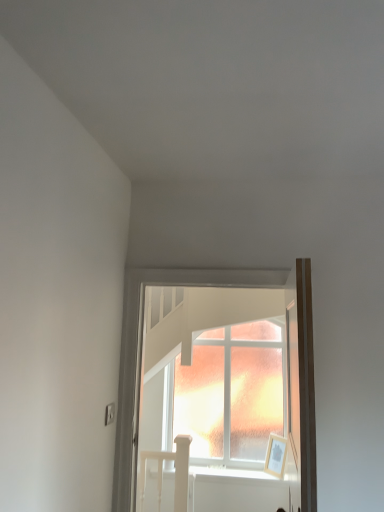
Locate an element on the screen. This screenshot has height=512, width=384. white wooden bed at lower left is located at coordinates (175, 472).

Describe the element at coordinates (175, 472) in the screenshot. The height and width of the screenshot is (512, 384). I see `white wooden bed at lower left` at that location.

Measure the distance between point (158, 472) and camera.

Point (158, 472) and camera are 14.06 feet apart from each other.

What do you see at coordinates (141, 356) in the screenshot? I see `frosted glass window at center` at bounding box center [141, 356].

Find the location of a particular element. The width and height of the screenshot is (384, 512). frosted glass window at center is located at coordinates (141, 356).

In order to face frosted glass window at center, should I rotate leftwards or rightwards?

It's best to rotate right around 2.630 degrees.

Locate an element on the screen. The height and width of the screenshot is (512, 384). white wooden bed at lower left is located at coordinates (175, 472).

Looking at this image, is white wooden bed at lower left to the right of frosted glass window at center from the viewer's perspective?

No, white wooden bed at lower left is not to the right of frosted glass window at center.

Which object is closer to the camera, white wooden bed at lower left or frosted glass window at center?

frosted glass window at center.

Which is behind, point (178, 486) or point (306, 502)?

Point (178, 486)

From the image's perspective, is white wooden bed at lower left under frosted glass window at center?

Indeed, from the image's perspective, white wooden bed at lower left is shown beneath frosted glass window at center.

From a real-world perspective, is white wooden bed at lower left on top of frosted glass window at center?

No.

Which of these two, white wooden bed at lower left or frosted glass window at center, is thinner?

white wooden bed at lower left is thinner.

Which of these two, white wooden bed at lower left or frosted glass window at center, stands taller?

frosted glass window at center is taller.

In terms of size, does white wooden bed at lower left appear bigger or smaller than frosted glass window at center?

white wooden bed at lower left is smaller than frosted glass window at center.

Is white wooden bed at lower left not inside frosted glass window at center?

Yes, white wooden bed at lower left is outside of frosted glass window at center.

Would you say white wooden bed at lower left is a long distance from frosted glass window at center?

That's right, there is a large distance between white wooden bed at lower left and frosted glass window at center.

Is white wooden bed at lower left oriented away from frosted glass window at center?

No, white wooden bed at lower left is not facing away from frosted glass window at center.

What's the angular difference between white wooden bed at lower left and frosted glass window at center's facing directions?

white wooden bed at lower left and frosted glass window at center are facing 0.86 degrees away from each other.

This screenshot has width=384, height=512. Identify the location of bed below the frosted glass window at center (from the image's perspective). (175, 472).

Is frosted glass window at center at the right side of white wooden bed at lower left?

Correct, you'll find frosted glass window at center to the right of white wooden bed at lower left.

Does frosted glass window at center lie behind white wooden bed at lower left?

No, it is not.

Is point (125, 488) farther from viewer compared to point (158, 451)?

No.

From the image's perspective, does frosted glass window at center appear lower than white wooden bed at lower left?

Incorrect, from the image's perspective, frosted glass window at center is higher than white wooden bed at lower left.

From a real-world perspective, between frosted glass window at center and white wooden bed at lower left, who is vertically lower?

In real-world perspective, white wooden bed at lower left is lower.

Between frosted glass window at center and white wooden bed at lower left, which one has smaller width?

With smaller width is white wooden bed at lower left.

Is frosted glass window at center taller than white wooden bed at lower left?

Correct, frosted glass window at center is much taller as white wooden bed at lower left.

Between frosted glass window at center and white wooden bed at lower left, which one has smaller size?

white wooden bed at lower left is smaller.

Is frosted glass window at center not inside white wooden bed at lower left?

Yes, frosted glass window at center is not within white wooden bed at lower left.

Is frosted glass window at center positioned far away from white wooden bed at lower left?

Indeed, frosted glass window at center is not near white wooden bed at lower left.

Is frosted glass window at center oriented towards white wooden bed at lower left?

No, frosted glass window at center is not facing towards white wooden bed at lower left.

Find the location of a particular element. The image size is (384, 512). window above the white wooden bed at lower left (from the image's perspective) is located at coordinates (141, 356).

Where is `window that appears in front of the white wooden bed at lower left`? The width and height of the screenshot is (384, 512). window that appears in front of the white wooden bed at lower left is located at coordinates (141, 356).

Locate an element on the screen. The width and height of the screenshot is (384, 512). window above the white wooden bed at lower left (from a real-world perspective) is located at coordinates (141, 356).